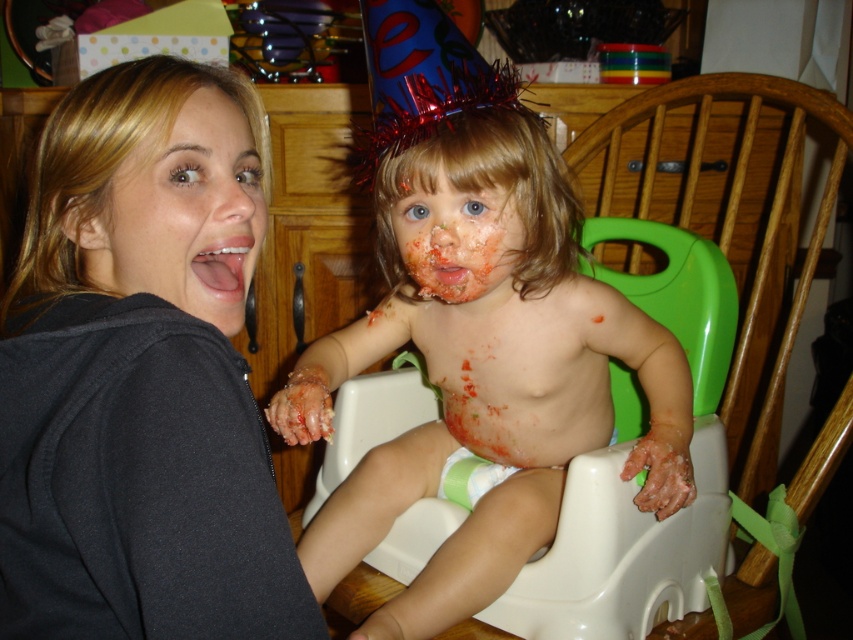
Does matte black hoodie at upper left appear under matte orange face at center?

Yes, matte black hoodie at upper left is below matte orange face at center.

Is matte black hoodie at upper left bigger than matte orange face at center?

Indeed, matte black hoodie at upper left has a larger size compared to matte orange face at center.

Identify the location of matte black hoodie at upper left. (134, 394).

This screenshot has width=853, height=640. I want to click on matte black hoodie at upper left, so click(134, 394).

Between matte black hoodie at upper left and matte plastic baby at center, which one appears on the left side from the viewer's perspective?

matte black hoodie at upper left

Between matte black hoodie at upper left and matte plastic baby at center, which one appears on the right side from the viewer's perspective?

matte plastic baby at center is more to the right.

Is point (128, 554) positioned in front of point (392, 307)?

Yes, point (128, 554) is closer to viewer.

Where is `matte black hoodie at upper left`? This screenshot has height=640, width=853. matte black hoodie at upper left is located at coordinates (134, 394).

Can you confirm if matte black hoodie at upper left is positioned below smooth skin face at left?

Correct, matte black hoodie at upper left is located below smooth skin face at left.

Who is lower down, matte black hoodie at upper left or smooth skin face at left?

matte black hoodie at upper left is lower down.

Does point (68, 536) come farther from viewer compared to point (186, 145)?

No, it is in front of (186, 145).

This screenshot has height=640, width=853. I want to click on matte black hoodie at upper left, so click(134, 394).